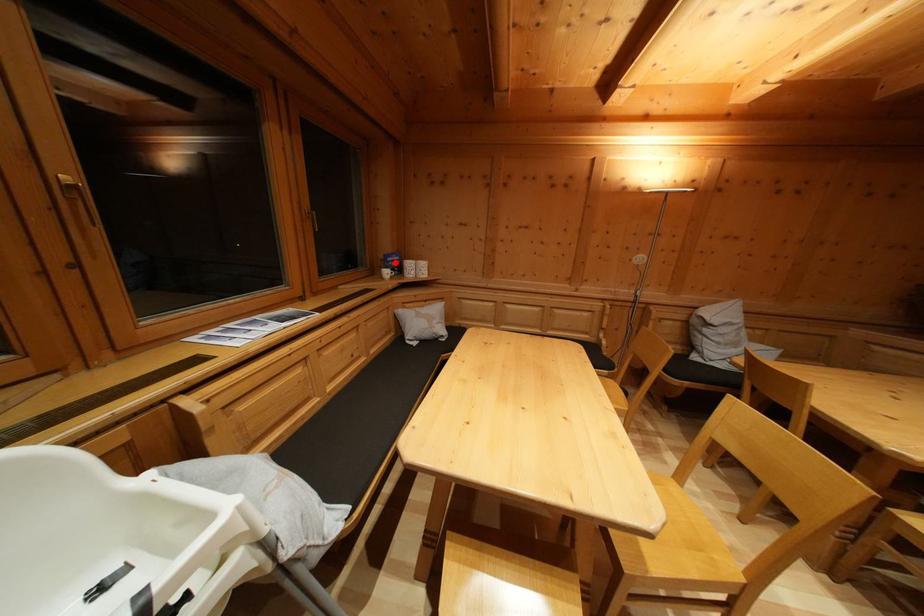
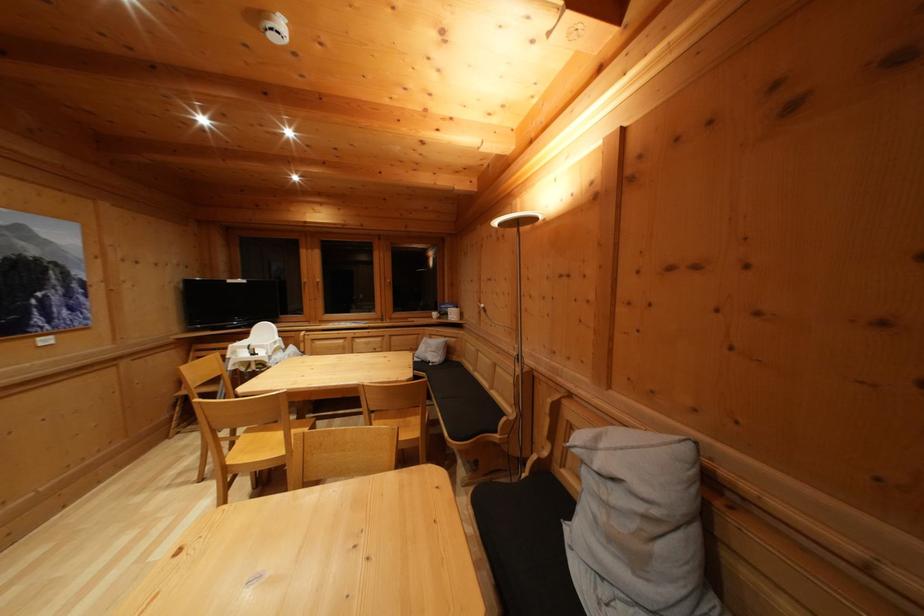
In the second image, find the point that corresponds to the highlighted location in the first image.

(450, 310)